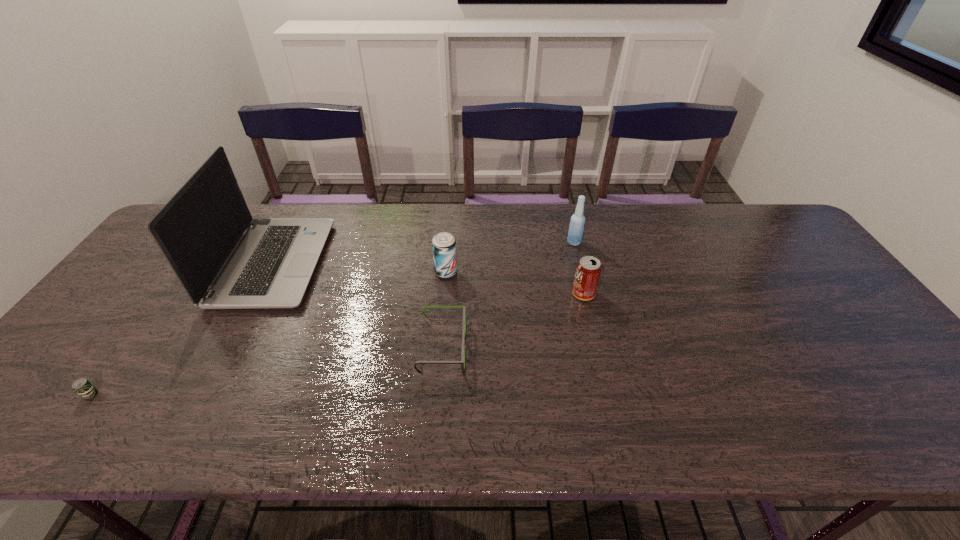
Locate an element on the screen. object located in the near left corner section of the desktop is located at coordinates (82, 386).

This screenshot has width=960, height=540. What are the coordinates of `vacant region at the far edge of the desktop` in the screenshot? It's located at (679, 215).

Where is `vacant space at the near edge of the desktop`? vacant space at the near edge of the desktop is located at coordinates (629, 410).

This screenshot has height=540, width=960. Identify the location of free region at the left edge. (102, 371).

Where is `vacant region at the right edge`? The image size is (960, 540). vacant region at the right edge is located at coordinates (787, 267).

You are a GUI agent. You are given a task and a screenshot of the screen. Output one action in this format:
    pyautogui.click(x=<x>, y=<y>)
    Task: Click on the vacant point located between the second tallest object and the spectacles
    
    Given the screenshot: What is the action you would take?
    pyautogui.click(x=508, y=295)

Locate an element on the screen. The image size is (960, 540). free spot between the soda can and the nearest object is located at coordinates (337, 345).

The width and height of the screenshot is (960, 540). In order to click on unoccupied position between the soda can and the taller beer can in this screenshot , I will do `click(515, 283)`.

Where is `free point between the fifth farthest object and the bottle`? free point between the fifth farthest object and the bottle is located at coordinates (508, 295).

At what (x,y) coordinates should I click in order to perform the action: click on vacant region between the fifth shortest object and the laptop computer. Please return your answer as a coordinate pair (x, y). Looking at the image, I should click on (424, 253).